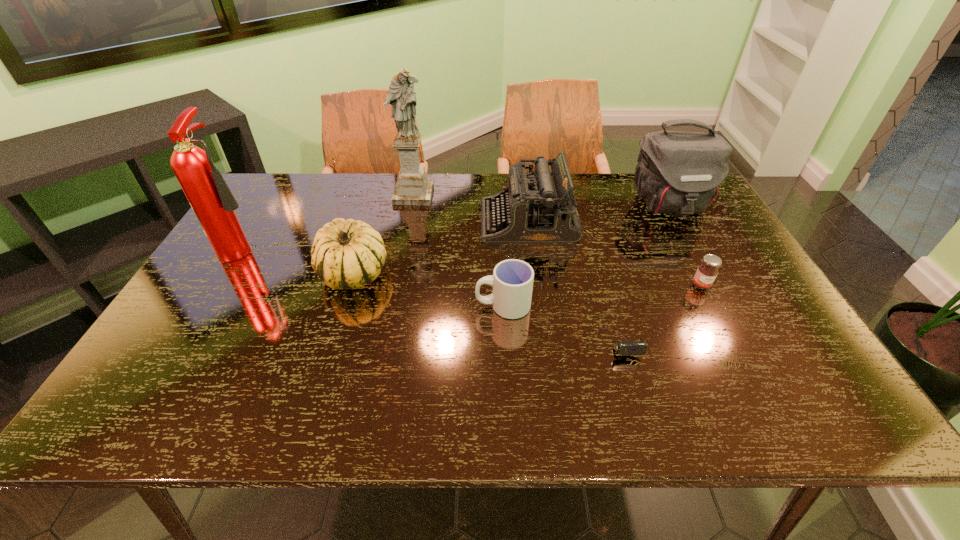
At what (x,y) coordinates should I click in order to perform the action: click on blank area located 0.150m on the open flap of the third tallest object. Please return your answer as a coordinate pair (x, y). The width and height of the screenshot is (960, 540). Looking at the image, I should click on (699, 260).

You are a GUI agent. You are given a task and a screenshot of the screen. Output one action in this format:
    pyautogui.click(x=<x>, y=<y>)
    Task: Click on the vacant space positioned 0.390m on the keyboard of the typewriter
    The image size is (960, 540).
    Given the screenshot: What is the action you would take?
    pyautogui.click(x=350, y=221)

The width and height of the screenshot is (960, 540). I want to click on free space located on the keyboard of the typewriter, so tap(361, 221).

Where is `blank area located on the keyboard of the typewriter`? This screenshot has height=540, width=960. blank area located on the keyboard of the typewriter is located at coordinates (380, 221).

Where is `vacant space located 0.090m on the back of the fourth shortest object`? This screenshot has width=960, height=540. vacant space located 0.090m on the back of the fourth shortest object is located at coordinates (367, 231).

I want to click on vacant area located 0.080m with the handle on the side of the cup, so click(443, 306).

Where is `vacant region located 0.160m with the handle on the side of the cup`? The image size is (960, 540). vacant region located 0.160m with the handle on the side of the cup is located at coordinates (411, 306).

Locate an element on the screen. This screenshot has width=960, height=540. vacant position located 0.240m with the handle on the side of the cup is located at coordinates (378, 306).

Locate an element on the screen. This screenshot has height=540, width=960. vacant space located 0.080m on the label side of the jam is located at coordinates (717, 315).

Locate an element on the screen. vacant space positioned on the front-facing side of the webcam is located at coordinates (633, 383).